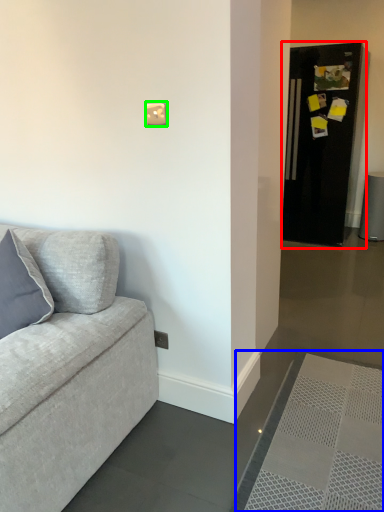
Question: Based on their relative distances, which object is nearer to fridge (highlighted by a red box)? Choose from doormat (highlighted by a blue box) and light switch (highlighted by a green box).

Choices:
 (A) doormat
 (B) light switch

Answer: (A)